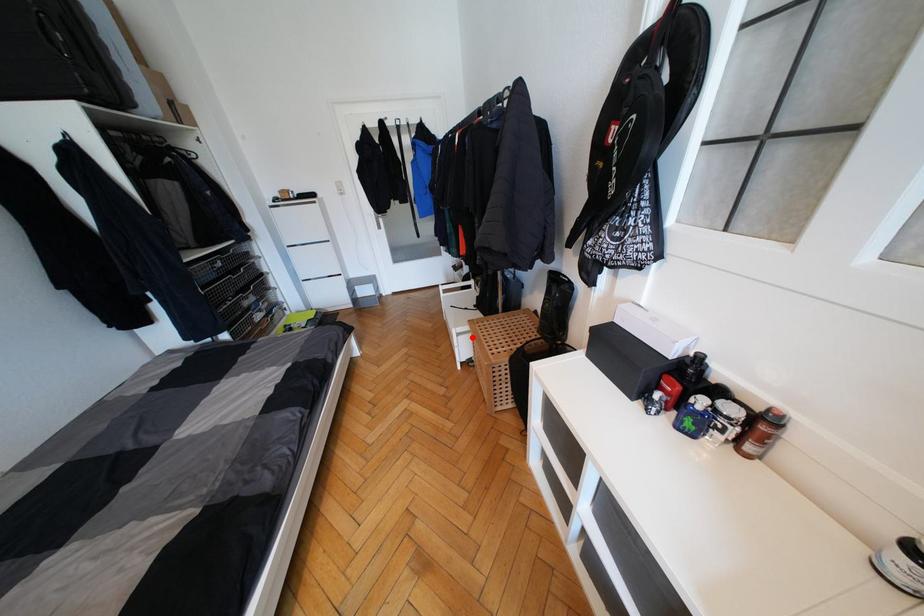
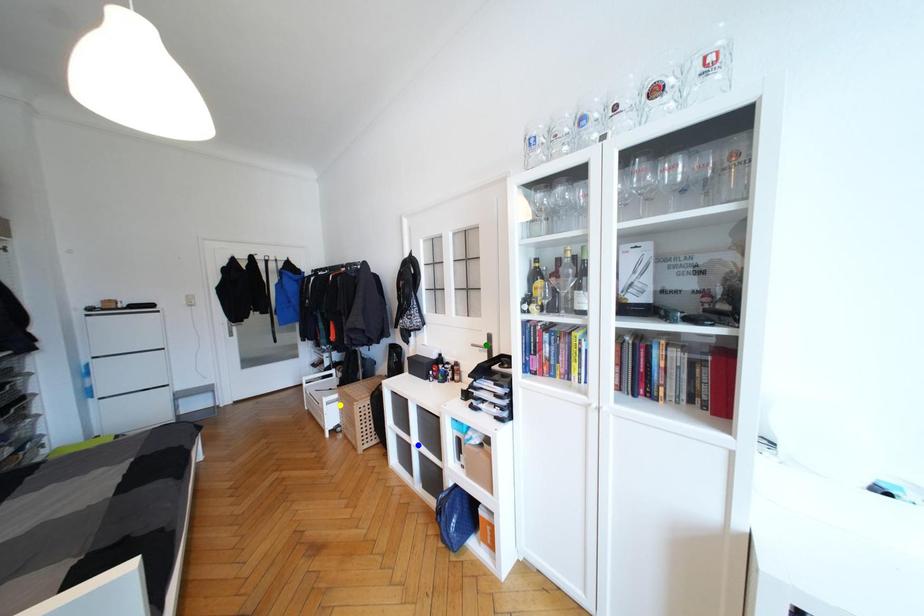
Question: I am providing you with two images of the same scene from different viewpoints. A red point is marked on the first image. You are given multiple points on the second image. Which spot in image 2 lines up with the point in image 1?

Choices:
 (A) yellow point
 (B) green point
 (C) blue point

Answer: (A)